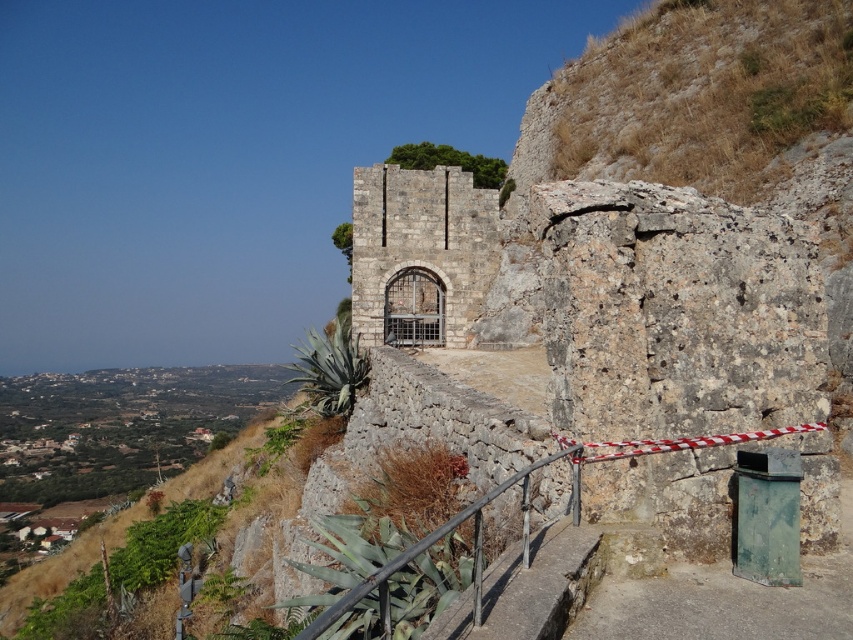
Which is above, rustic stone gate at center or rustic metal railing at center?

rustic stone gate at center is above.

Between point (401, 195) and point (593, 449), which one is positioned behind?

Point (401, 195)

Locate an element on the screen. This screenshot has height=640, width=853. rustic stone gate at center is located at coordinates (421, 253).